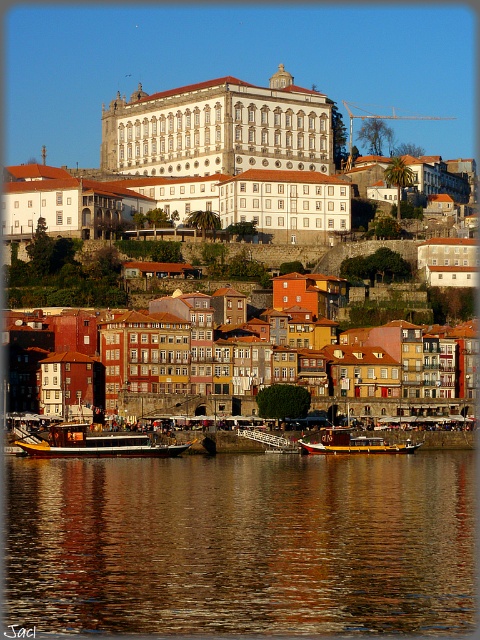
Question: Is yellow polished wood boat at lower left above wooden polished boat at center?

Choices:
 (A) no
 (B) yes

Answer: (B)

Question: Is brown reflective water at center below yellow polished wood boat at lower left?

Choices:
 (A) no
 (B) yes

Answer: (B)

Question: Which of these objects is positioned farthest from the white stone building at upper center?

Choices:
 (A) white stone building at center
 (B) wooden polished boat at center
 (C) brown reflective water at center

Answer: (C)

Question: Considering the relative positions of brown reflective water at center and wooden polished boat at center in the image provided, where is brown reflective water at center located with respect to wooden polished boat at center?

Choices:
 (A) below
 (B) above

Answer: (A)

Question: Which object appears closest to the camera in this image?

Choices:
 (A) white stone building at center
 (B) white stone building at upper center
 (C) yellow polished wood boat at lower left

Answer: (C)

Question: Which object is farther from the camera taking this photo?

Choices:
 (A) brown reflective water at center
 (B) wooden polished boat at center
 (C) white stone building at upper center
 (D) yellow polished wood boat at lower left

Answer: (C)